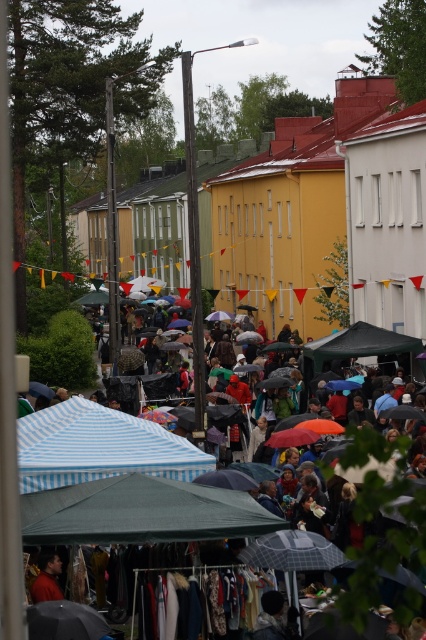
Is striped fabric tent at center below black fabric canopy at center?

Correct, striped fabric tent at center is located below black fabric canopy at center.

Which is more to the left, striped fabric tent at center or black fabric canopy at center?

From the viewer's perspective, striped fabric tent at center appears more on the left side.

I want to click on striped fabric tent at center, so click(108, 515).

Between green fabric canopy at lower center and striped fabric tent at center, which one has more height?

With more height is striped fabric tent at center.

Who is more forward, (77, 492) or (391, 540)?

Point (77, 492)

Image resolution: width=426 pixels, height=640 pixels. Identify the location of green fabric canopy at lower center. (141, 513).

Describe the element at coordinates (98, 445) in the screenshot. I see `blue striped canopy at center` at that location.

Which is in front, point (98, 406) or point (39, 556)?

Point (39, 556) is more forward.

Where is `blue striped canopy at center`? This screenshot has width=426, height=640. blue striped canopy at center is located at coordinates (98, 445).